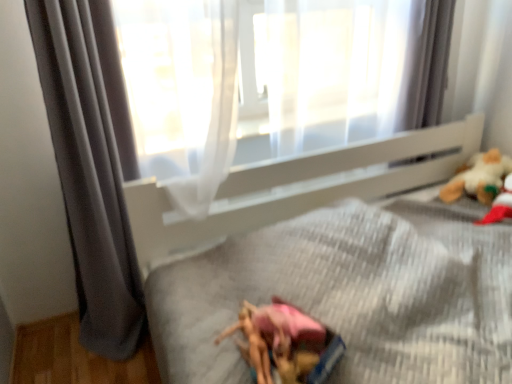
Question: Is point (109, 274) positioned closer to the camera than point (458, 178)?

Choices:
 (A) farther
 (B) closer

Answer: (B)

Question: From their relative heights in the image, would you say gray fabric curtain at left is taller or shorter than white plush bear at upper right?

Choices:
 (A) tall
 (B) short

Answer: (A)

Question: Is gray fabric curtain at left wider or thinner than white plush bear at upper right?

Choices:
 (A) thin
 (B) wide

Answer: (A)

Question: From the image's perspective, is white plush bear at upper right positioned above or below gray fabric curtain at left?

Choices:
 (A) above
 (B) below

Answer: (A)

Question: Would you say white plush bear at upper right is to the left or to the right of gray fabric curtain at left in the picture?

Choices:
 (A) right
 (B) left

Answer: (A)

Question: From a real-world perspective, is white plush bear at upper right positioned above or below gray fabric curtain at left?

Choices:
 (A) above
 (B) below

Answer: (B)

Question: In terms of height, does white plush bear at upper right look taller or shorter compared to gray fabric curtain at left?

Choices:
 (A) short
 (B) tall

Answer: (A)